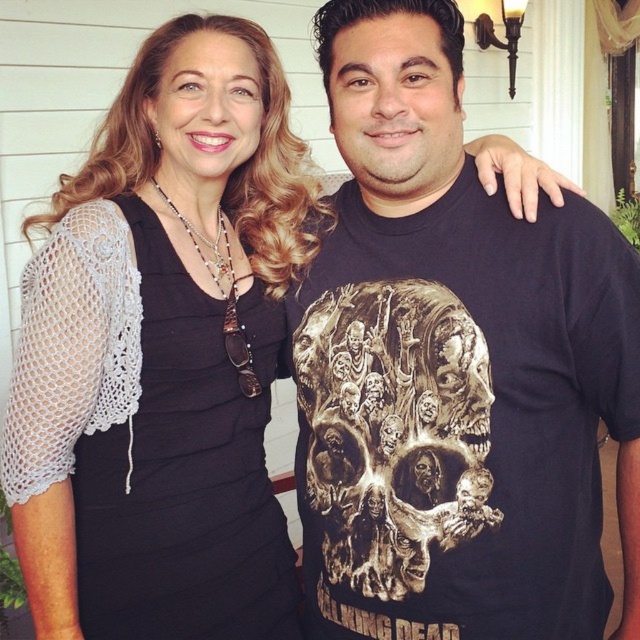
Question: Which is nearer to the black crochet dress at left?

Choices:
 (A) gold metallic skull at center
 (B) black matte t-shirt at center

Answer: (A)

Question: Which point appears closest to the camera in this image?

Choices:
 (A) (605, 259)
 (B) (465, 371)
 (C) (156, 291)

Answer: (A)

Question: Does black matte t-shirt at center have a greater width compared to black crochet dress at left?

Choices:
 (A) yes
 (B) no

Answer: (A)

Question: Which of the following is the farthest from the observer?

Choices:
 (A) (166, 483)
 (B) (449, 417)

Answer: (A)

Question: Is black crochet dress at left in front of gold metallic skull at center?

Choices:
 (A) no
 (B) yes

Answer: (A)

Question: Where is black crochet dress at left located in relation to gold metallic skull at center in the image?

Choices:
 (A) below
 (B) above

Answer: (A)